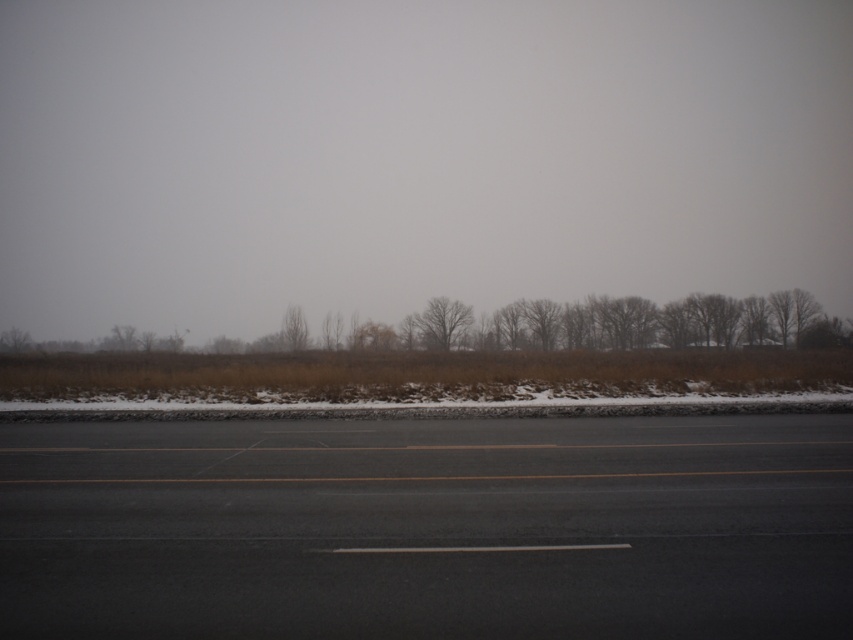
Can you confirm if foggy atmosphere at upper center is wider than black asphalt highway at center?

Indeed, foggy atmosphere at upper center has a greater width compared to black asphalt highway at center.

Who is shorter, foggy atmosphere at upper center or black asphalt highway at center?

With less height is black asphalt highway at center.

Image resolution: width=853 pixels, height=640 pixels. Describe the element at coordinates (415, 157) in the screenshot. I see `foggy atmosphere at upper center` at that location.

Identify the location of foggy atmosphere at upper center. (415, 157).

Is black asphalt highway at center positioned in front of brown matte tree at center?

Yes.

Is black asphalt highway at center thinner than brown matte tree at center?

Incorrect, black asphalt highway at center's width is not less than brown matte tree at center's.

Where is `black asphalt highway at center`? black asphalt highway at center is located at coordinates (428, 529).

Does brown matte trees at center appear under brown matte tree at center?

Actually, brown matte trees at center is above brown matte tree at center.

From the picture: Who is more forward, [527,330] or [294,314]?

Point [527,330] is more forward.

Does point (606, 332) come behind point (283, 336)?

No.

At what (x,y) coordinates should I click in order to perform the action: click on brown matte trees at center. Please return your answer as a coordinate pair (x, y). Looking at the image, I should click on (605, 324).